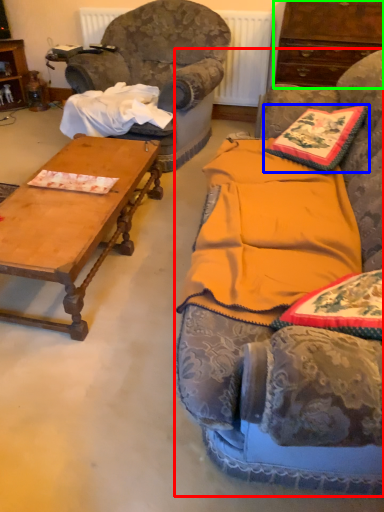
Question: Which is farther away from studio couch (highlighted by a red box)? pillow (highlighted by a blue box) or cabinetry (highlighted by a green box)?

Choices:
 (A) pillow
 (B) cabinetry

Answer: (B)